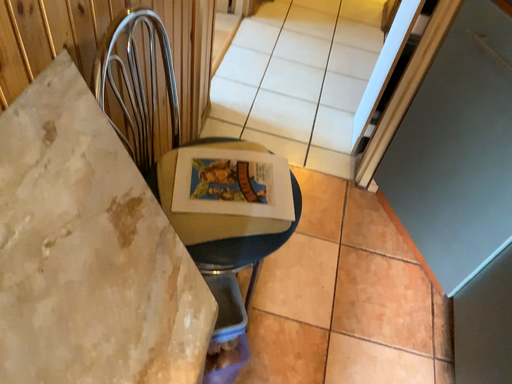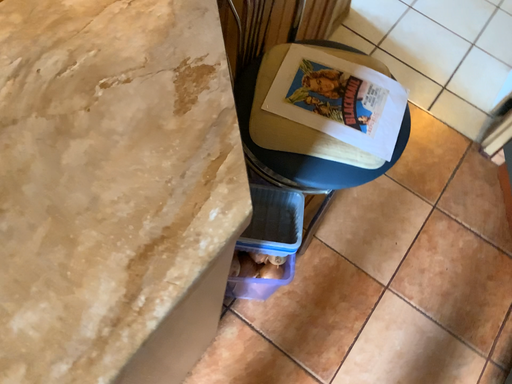
Question: How did the camera likely rotate when shooting the video?

Choices:
 (A) rotated downward
 (B) rotated upward

Answer: (A)